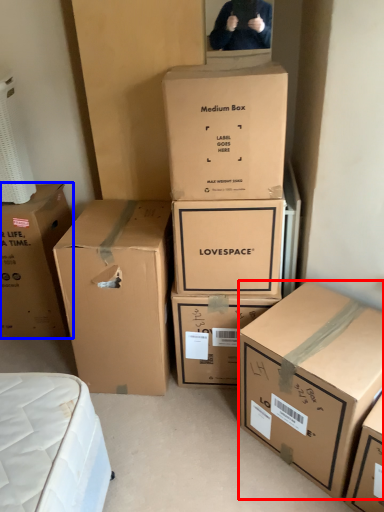
Question: Which of the following is the closest to the observer, box (highlighted by a red box) or box (highlighted by a blue box)?

Choices:
 (A) box
 (B) box

Answer: (A)